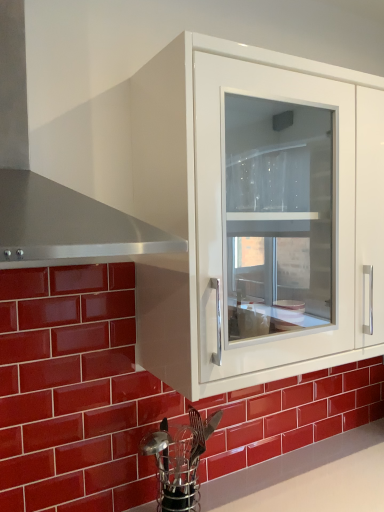
Question: From the image's perspective, is metallic silver utensil holder at lower center located above or below stainless steel exhaust hood at left?

Choices:
 (A) below
 (B) above

Answer: (A)

Question: From their relative heights in the image, would you say metallic silver utensil holder at lower center is taller or shorter than stainless steel exhaust hood at left?

Choices:
 (A) short
 (B) tall

Answer: (A)

Question: Considering the real-world distances, which object is closest to the stainless steel exhaust hood at left?

Choices:
 (A) metallic silver utensil holder at lower center
 (B) glossy ceramic brick at lower left
 (C) white glossy cabinet at upper center

Answer: (C)

Question: Estimate the real-world distances between objects in this image. Which object is closer to the glossy ceramic brick at lower left?

Choices:
 (A) metallic silver utensil holder at lower center
 (B) white glossy cabinet at upper center
 (C) stainless steel exhaust hood at left

Answer: (A)